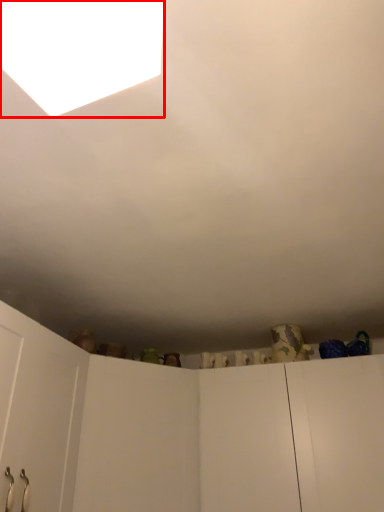
Question: From the image's perspective, considering the relative positions of light (annotated by the red box) and door in the image provided, where is light (annotated by the red box) located with respect to the staircase?

Choices:
 (A) below
 (B) above

Answer: (B)